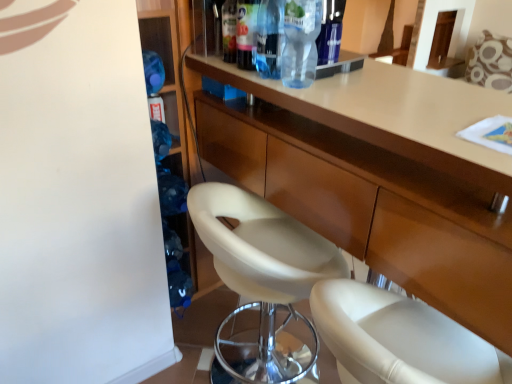
Question: Is transparent plastic bottle at upper center, which is counted as the third bottle, starting from the right, not near transparent plastic bottle at upper center, the 4th bottle from the left?

Choices:
 (A) no
 (B) yes

Answer: (A)

Question: Is transparent plastic bottle at upper center, which is counted as the third bottle, starting from the right, positioned in front of transparent plastic bottle at upper center, the first bottle in the right-to-left sequence?

Choices:
 (A) no
 (B) yes

Answer: (A)

Question: Is transparent plastic bottle at upper center, which is counted as the third bottle, starting from the right, at the left side of transparent plastic bottle at upper center, the first bottle in the right-to-left sequence?

Choices:
 (A) yes
 (B) no

Answer: (A)

Question: Can you confirm if transparent plastic bottle at upper center, which is counted as the third bottle, starting from the right, is taller than transparent plastic bottle at upper center, the first bottle in the right-to-left sequence?

Choices:
 (A) yes
 (B) no

Answer: (A)

Question: Is transparent plastic bottle at upper center, the 4th bottle from the left, surrounded by transparent plastic bottle at upper center, which is counted as the third bottle, starting from the right?

Choices:
 (A) yes
 (B) no

Answer: (B)

Question: Is white leather chair at center wider or thinner than transparent plastic bottle at upper center, the third bottle viewed from the left?

Choices:
 (A) wide
 (B) thin

Answer: (B)

Question: From the image's perspective, relative to transparent plastic bottle at upper center, the third bottle viewed from the left, is white leather chair at center above or below?

Choices:
 (A) above
 (B) below

Answer: (B)

Question: Considering the relative positions of white leather chair at center and transparent plastic bottle at upper center, positioned as the 2th bottle in right-to-left order, in the image provided, is white leather chair at center to the left or to the right of transparent plastic bottle at upper center, positioned as the 2th bottle in right-to-left order,?

Choices:
 (A) right
 (B) left

Answer: (B)

Question: Would you say white leather chair at center is inside or outside transparent plastic bottle at upper center, positioned as the 2th bottle in right-to-left order?

Choices:
 (A) inside
 (B) outside

Answer: (B)

Question: From a real-world perspective, is transparent plastic bottle at upper center, which ranks as the 2th bottle in left-to-right order, positioned above or below transparent plastic bottle at upper center, the 4th bottle from the left?

Choices:
 (A) below
 (B) above

Answer: (B)

Question: Considering the positions of transparent plastic bottle at upper center, which is counted as the third bottle, starting from the right, and transparent plastic bottle at upper center, the first bottle in the right-to-left sequence, in the image, is transparent plastic bottle at upper center, which is counted as the third bottle, starting from the right, taller or shorter than transparent plastic bottle at upper center, the first bottle in the right-to-left sequence,?

Choices:
 (A) short
 (B) tall

Answer: (B)

Question: Does point (261, 13) appear closer or farther from the camera than point (310, 16)?

Choices:
 (A) closer
 (B) farther

Answer: (B)

Question: Based on their positions, is transparent plastic bottle at upper center, which is counted as the third bottle, starting from the right, located to the left or right of transparent plastic bottle at upper center, the 4th bottle from the left?

Choices:
 (A) right
 (B) left

Answer: (B)

Question: Is matte wood cabinet at center in front of or behind transparent plastic bottle at upper center, which is counted as the third bottle, starting from the right, in the image?

Choices:
 (A) front
 (B) behind

Answer: (A)

Question: From the image's perspective, relative to transparent plastic bottle at upper center, which is counted as the third bottle, starting from the right, is matte wood cabinet at center above or below?

Choices:
 (A) below
 (B) above

Answer: (A)